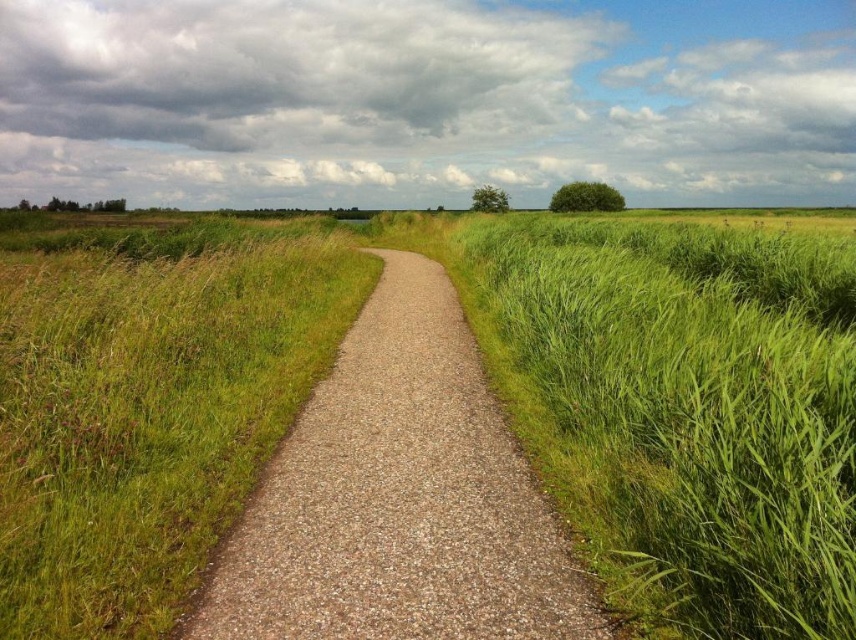
Question: Does green grassy wheat field at center come behind brown gravel path at center?

Choices:
 (A) yes
 (B) no

Answer: (B)

Question: Is green grassy wheat field at center closer to the viewer compared to brown gravel path at center?

Choices:
 (A) no
 (B) yes

Answer: (B)

Question: Which of the following is the closest to the observer?

Choices:
 (A) brown gravel path at center
 (B) green grassy wheat field at center

Answer: (B)

Question: Does green grassy wheat field at center have a smaller size compared to brown gravel path at center?

Choices:
 (A) yes
 (B) no

Answer: (B)